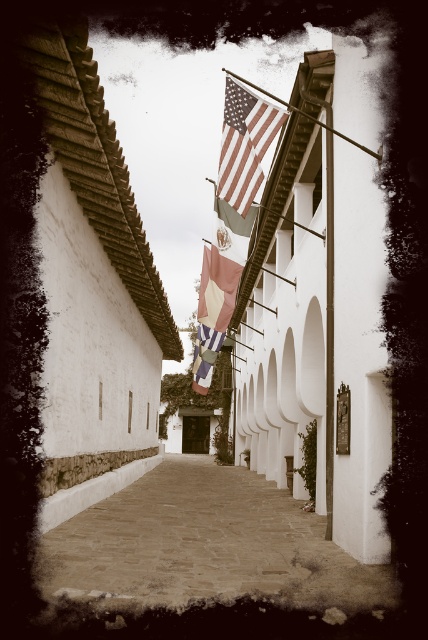
You are a tourist standing at the entrance of the alley. You want to walk to the end of the alley while avoiding getting your head hit by the pink fabric flag at center. Is the smooth stone alley at center wide enough for you to walk through without ducking?

The smooth stone alley at center is positioned under the pink fabric flag at center, so the flag is above the alley. Since the flag is above, you can walk through the alley without needing to duck as there is no indication of the flag being low enough to hit your head.

In the scene shown: You are standing in the narrow alleyway and want to hang a new decorative flag between the american flag at upper center and the pink fabric flag at center. Based on their positions, which flag should you place the new flag closer to if you want it to appear closer to the viewer?

The american flag at upper center is closer to the viewer than the pink fabric flag at center, so placing the new flag closer to the american flag at upper center would make it appear closer to the viewer.

You are standing at the entrance of the alley and want to place a small decorative item between the two points labeled point (264, 509) and point (237, 76). Which point should the item be placed closer to if you want it to be in front of the other point?

The item should be placed closer to point (237, 76) because point (264, 509) is behind point (237, 76), so placing it near the front point ensures visibility.